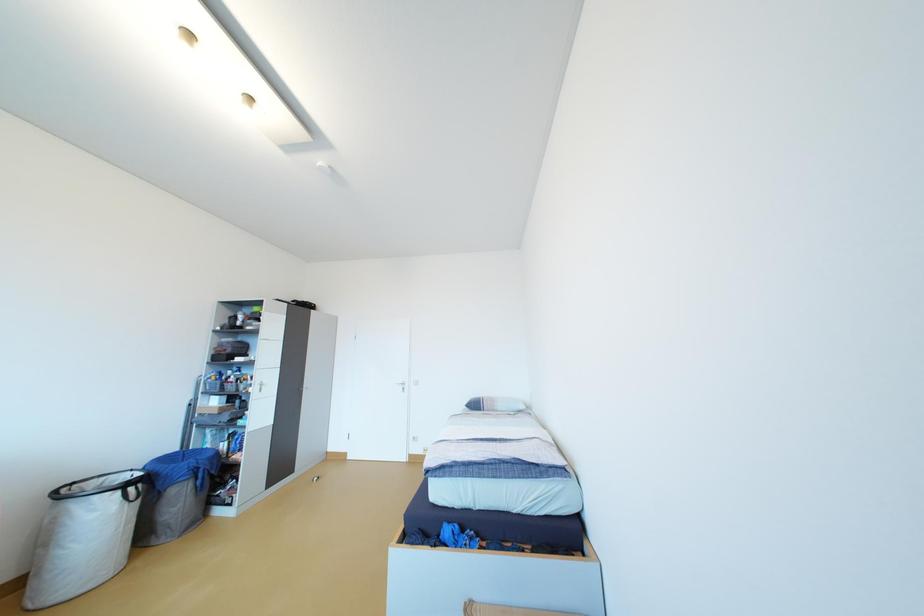
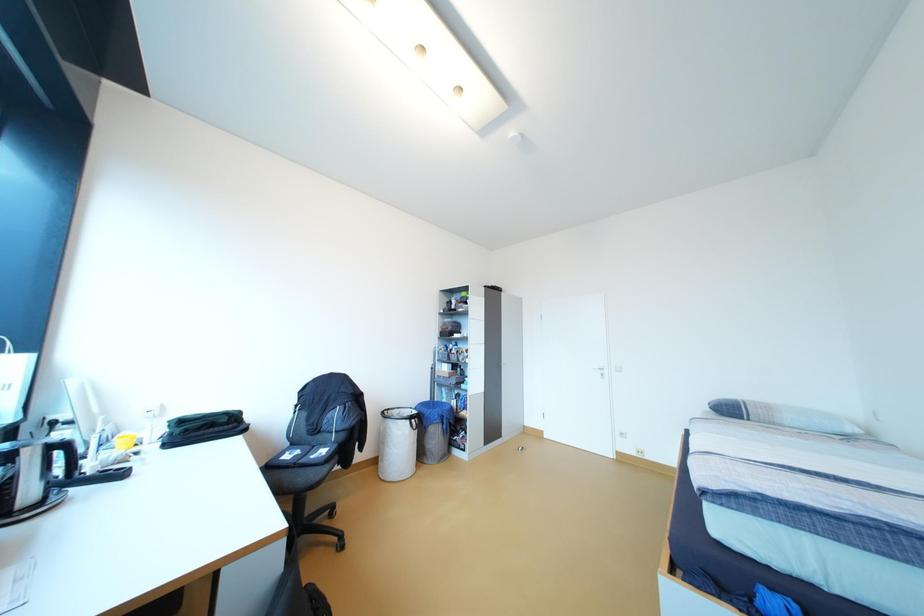
Question: Based on the continuous images, in which direction is the camera rotating? Reply with the corresponding letter.

Choices:
 (A) Left
 (B) Right
 (C) Up
 (D) Down

Answer: (A)